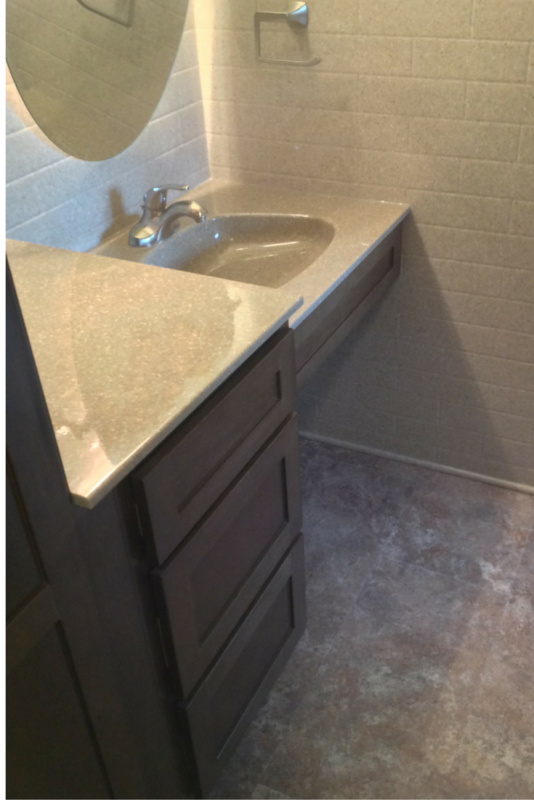
The image size is (534, 800). I want to click on towel rack, so tap(277, 17).